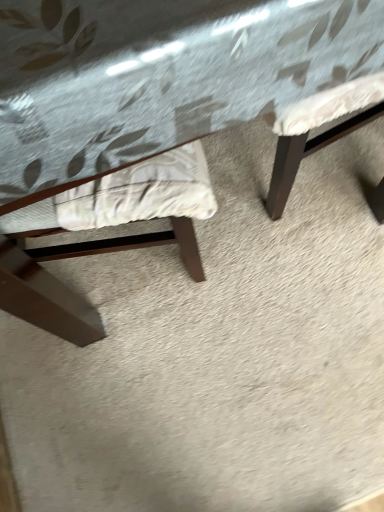
Question: Would you say wooden table at center is to the left or to the right of fabric cushioned chair at left in the picture?

Choices:
 (A) right
 (B) left

Answer: (A)

Question: From a real-world perspective, is wooden table at center above or below fabric cushioned chair at left?

Choices:
 (A) below
 (B) above

Answer: (A)

Question: Do you think wooden table at center is within fabric cushioned chair at left, or outside of it?

Choices:
 (A) outside
 (B) inside

Answer: (A)

Question: Is fabric cushioned chair at left inside the boundaries of wooden table at center, or outside?

Choices:
 (A) outside
 (B) inside

Answer: (B)

Question: From the image's perspective, is fabric cushioned chair at left located above or below wooden table at center?

Choices:
 (A) below
 (B) above

Answer: (A)

Question: Considering their positions, is fabric cushioned chair at left located in front of or behind wooden table at center?

Choices:
 (A) front
 (B) behind

Answer: (B)

Question: Is fabric cushioned chair at left bigger or smaller than wooden table at center?

Choices:
 (A) big
 (B) small

Answer: (B)